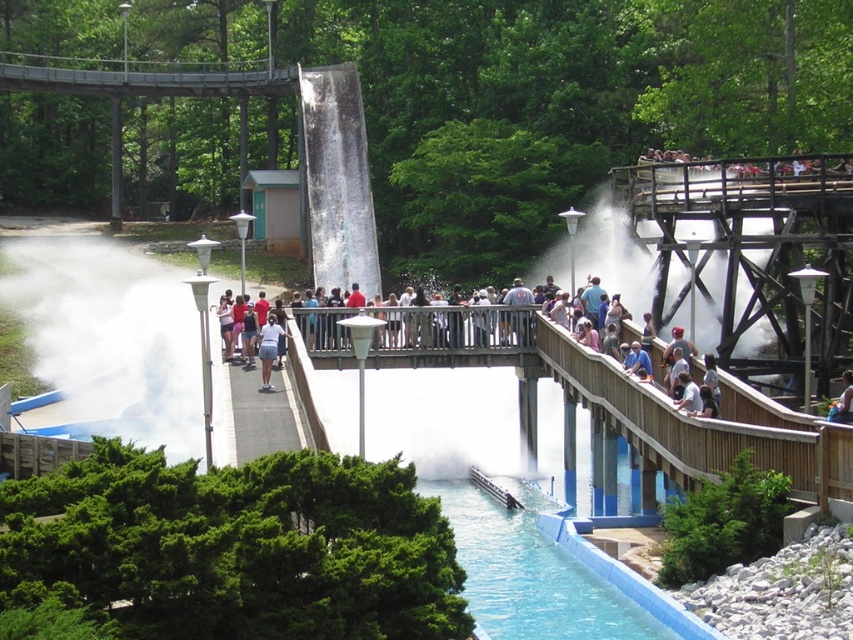
Can you confirm if white matte water at upper center is wider than white cotton shirt at center?

Indeed, white matte water at upper center has a greater width compared to white cotton shirt at center.

How far apart are white matte water at upper center and white cotton shirt at center?

The distance of white matte water at upper center from white cotton shirt at center is 21.63 meters.

In order to click on white matte water at upper center in this screenshot , I will do `click(614, 253)`.

The width and height of the screenshot is (853, 640). Describe the element at coordinates (111, 337) in the screenshot. I see `white mist at center` at that location.

How distant is white mist at center from white cotton shirt at center?

A distance of 23.84 meters exists between white mist at center and white cotton shirt at center.

Where is `white mist at center`? white mist at center is located at coordinates (111, 337).

The width and height of the screenshot is (853, 640). In order to click on white mist at center in this screenshot , I will do `click(111, 337)`.

Does white mist at center appear under blue denim shorts at upper center?

Actually, white mist at center is above blue denim shorts at upper center.

Between point (181, 358) and point (840, 397), which one is positioned in front?

Point (840, 397) is in front.

The height and width of the screenshot is (640, 853). In order to click on white mist at center in this screenshot , I will do `click(111, 337)`.